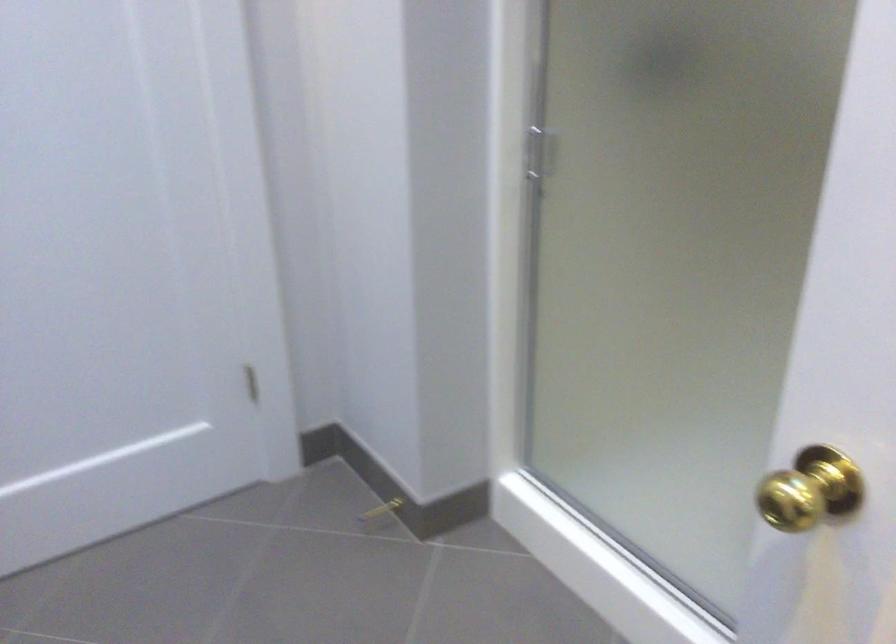
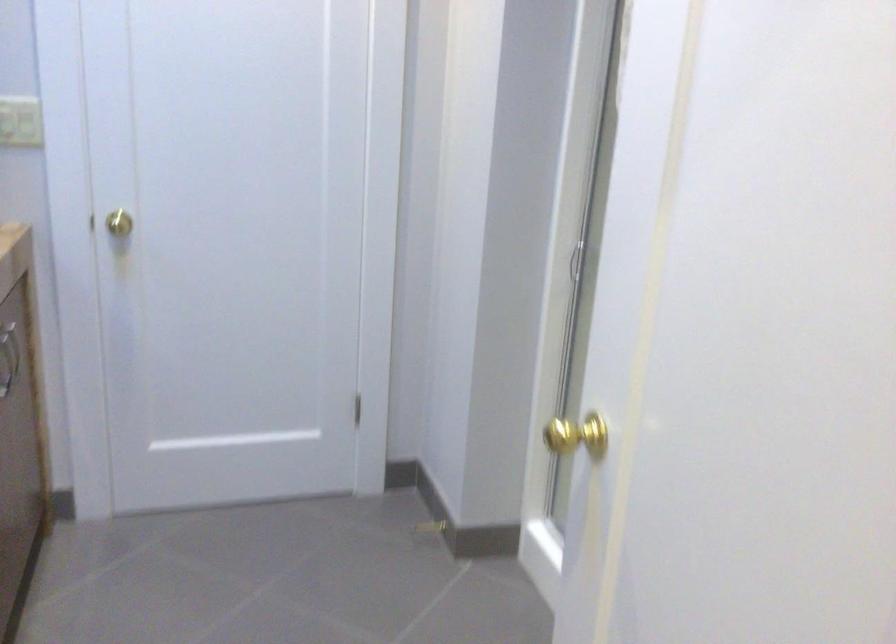
Which direction would the cameraman need to move to produce the second image?

The cameraman walked toward right, backward.